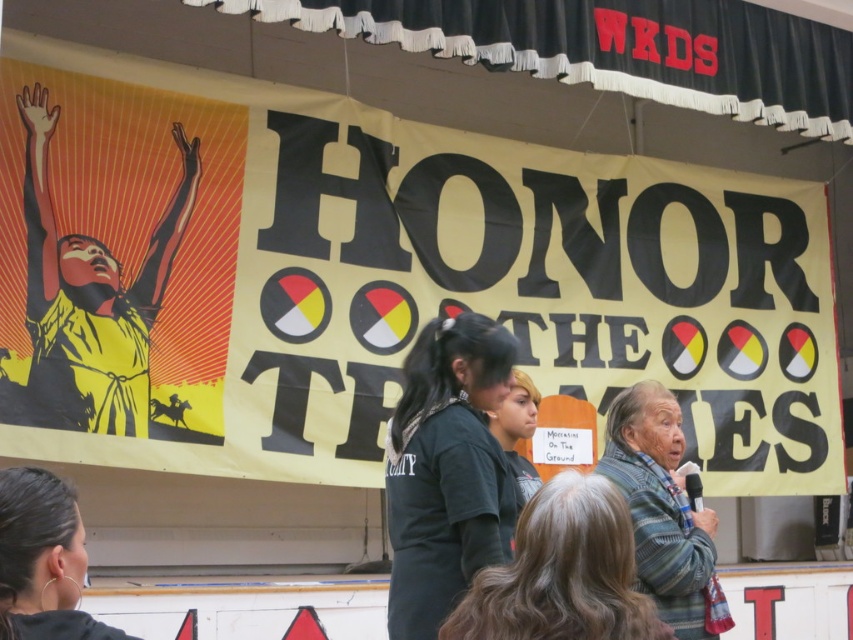
Which of these two, black matte shirt at center or matte black shirt at lower left, stands taller?

black matte shirt at center

Between black matte shirt at center and matte black shirt at lower left, which one has less height?

matte black shirt at lower left

Where is `black matte shirt at center`? black matte shirt at center is located at coordinates (445, 470).

Is gray hair at lower center positioned in front of matte black shirt at lower left?

No, it is behind matte black shirt at lower left.

How much distance is there between gray hair at lower center and matte black shirt at lower left?

gray hair at lower center is 6.97 feet away from matte black shirt at lower left.

Between point (474, 621) and point (51, 541), which one is positioned in front?

Positioned in front is point (51, 541).

You are a GUI agent. You are given a task and a screenshot of the screen. Output one action in this format:
    pyautogui.click(x=<x>, y=<y>)
    Task: Click on the gray hair at lower center
    Image resolution: width=853 pixels, height=640 pixels.
    Given the screenshot: What is the action you would take?
    pyautogui.click(x=561, y=572)

Measure the distance from yellow matte poster at center to black matte shirt at center.

The distance of yellow matte poster at center from black matte shirt at center is 5.77 meters.

Does yellow matte poster at center have a smaller size compared to black matte shirt at center?

No, yellow matte poster at center is not smaller than black matte shirt at center.

Is point (210, 404) closer to camera compared to point (450, 605)?

No, (210, 404) is behind (450, 605).

Find the location of a particular element. yellow matte poster at center is located at coordinates (379, 280).